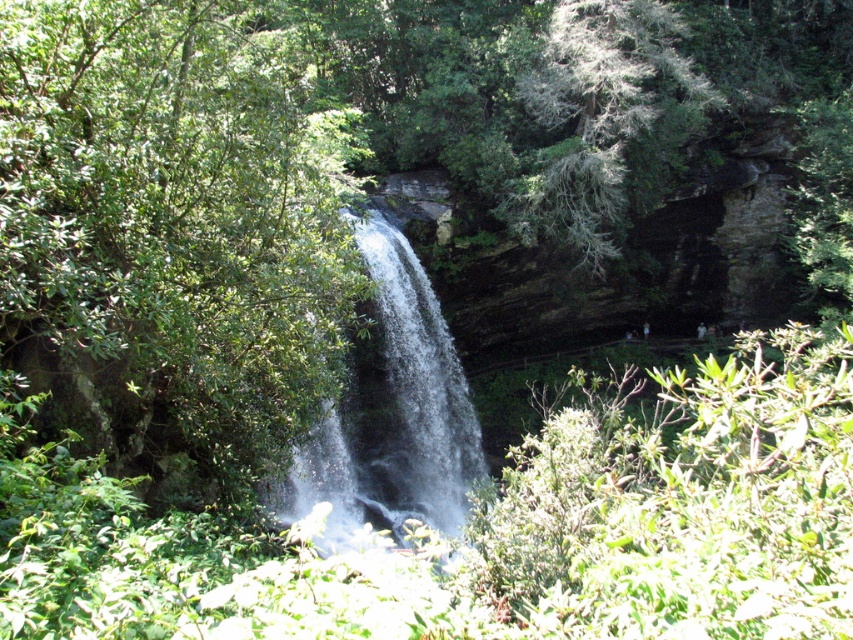
You are standing at the edge of the waterfall and notice a green leafy tree at center and clear water at center. Which object is positioned higher in the scene?

The green leafy tree at center is located above the clear water at center, so it is positioned higher in the scene.

You are standing at the edge of the waterfall and want to take a photo of both the green leafy tree at center and the clear water at center. Which object should you position to the right side of your camera frame?

You should position the clear water at center to the right side of your camera frame because the green leafy tree at center is to the left of it.

You are standing at the base of the waterfall in the image and want to take a photo of the point located at coordinates point (430, 404). Based on the scene description, is the point within the camera frame if your camera has a focal length of 50mm and a sensor size of 24mm x 36mm?

The point at point (430, 404) is 27.19 meters away from the camera. With a focal length of 50mm and sensor size 24mm x 36mm, the camera can capture objects at that distance within its field of view, so the point should be within the frame.